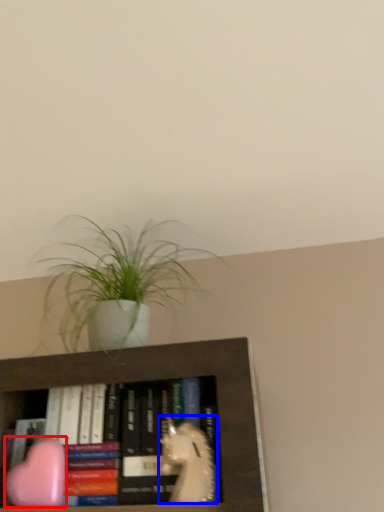
Question: Which point is closer to the camera, animal (highlighted by a red box) or animal (highlighted by a blue box)?

Choices:
 (A) animal
 (B) animal

Answer: (B)